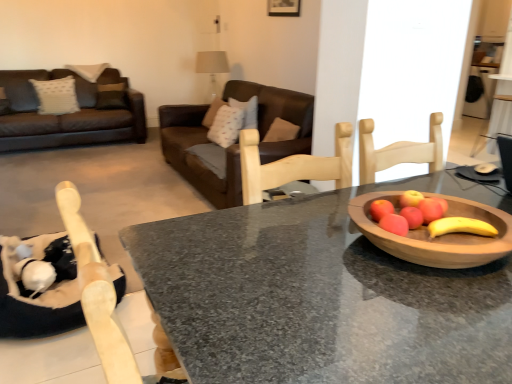
Identify the location of vacant area that lies in front of wooden bowl at right. (415, 329).